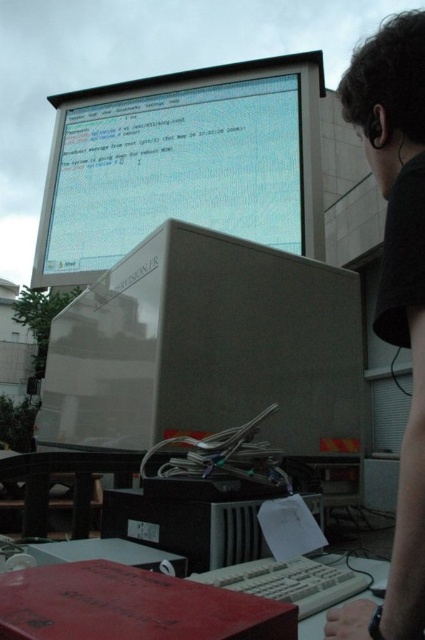
Does matte gray monitor at upper center have a lesser width compared to black matte shirt at upper right?

Incorrect, matte gray monitor at upper center's width is not less than black matte shirt at upper right's.

Between point (195, 120) and point (385, 284), which one is positioned in front?

Point (385, 284) is in front.

At what (x,y) coordinates should I click in order to perform the action: click on matte gray monitor at upper center. Please return your answer as a coordinate pair (x, y). The height and width of the screenshot is (640, 425). Looking at the image, I should click on (183, 163).

Measure the distance between satin white monitor at center and camera.

The distance of satin white monitor at center from camera is 4.28 feet.

Does satin white monitor at center have a greater width compared to black matte shirt at upper right?

Yes.

Find the location of a particular element. The image size is (425, 640). satin white monitor at center is located at coordinates (206, 348).

Who is taller, satin white monitor at center or matte gray monitor at upper center?

With more height is matte gray monitor at upper center.

Is satin white monitor at center thinner than matte gray monitor at upper center?

Indeed, satin white monitor at center has a lesser width compared to matte gray monitor at upper center.

Where is `satin white monitor at center`? satin white monitor at center is located at coordinates [206, 348].